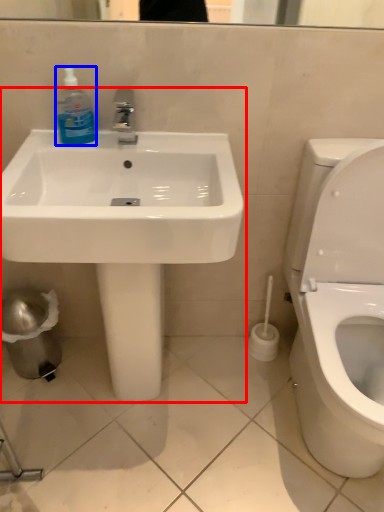
Question: Which of the following is the farthest to the observer, sink (highlighted by a red box) or cleaning product (highlighted by a blue box)?

Choices:
 (A) sink
 (B) cleaning product

Answer: (B)